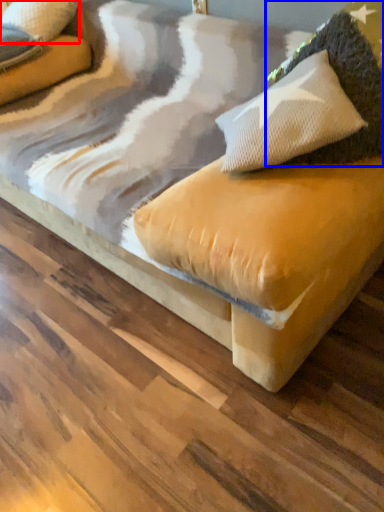
Question: Which of the following is the closest to the observer, pillow (highlighted by a red box) or pillow (highlighted by a blue box)?

Choices:
 (A) pillow
 (B) pillow

Answer: (B)